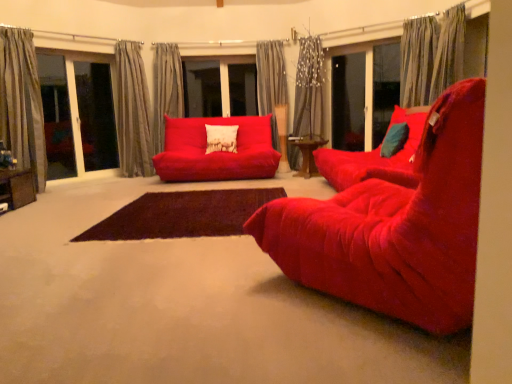
How much space does silky gray curtain at upper right, marked as the 1th curtain in a right-to-left arrangement, occupy horizontally?

silky gray curtain at upper right, marked as the 1th curtain in a right-to-left arrangement, is 13.60 inches in width.

How much space does textured beige curtain at upper left, placed as the 4th curtain when sorted from right to left, occupy horizontally?

textured beige curtain at upper left, placed as the 4th curtain when sorted from right to left, is 14.01 inches in width.

The image size is (512, 384). Find the location of `wooden table at center, the 1th table in the right-to-left sequence`. wooden table at center, the 1th table in the right-to-left sequence is located at coordinates (307, 154).

What do you see at coordinates (307, 154) in the screenshot? I see `wooden table at center, which is counted as the 2th table, starting from the left` at bounding box center [307, 154].

Locate an element on the screen. The height and width of the screenshot is (384, 512). gray textured curtain at center, acting as the 3th curtain starting from the right is located at coordinates (273, 94).

What do you see at coordinates (273, 94) in the screenshot? I see `gray textured curtain at center, which ranks as the fourth curtain in left-to-right order` at bounding box center [273, 94].

Where is `velvet red studio couch at center`? velvet red studio couch at center is located at coordinates (216, 151).

Is the depth of gray textured curtain at center, acting as the 3th curtain starting from the right, greater than that of transparent glass screen door at center, marked as the 2th screen door in a right-to-left arrangement?

Yes, it is behind transparent glass screen door at center, marked as the 2th screen door in a right-to-left arrangement.

From a real-world perspective, between gray textured curtain at center, acting as the 3th curtain starting from the right, and transparent glass screen door at center, arranged as the first screen door when viewed from the left, who is vertically higher?

gray textured curtain at center, acting as the 3th curtain starting from the right, is physically above.

Can transparent glass screen door at center, marked as the 2th screen door in a right-to-left arrangement, be found inside gray textured curtain at center, acting as the 3th curtain starting from the right?

Actually, transparent glass screen door at center, marked as the 2th screen door in a right-to-left arrangement, is outside gray textured curtain at center, acting as the 3th curtain starting from the right.

From the image's perspective, is silky gray curtain at upper right, which is the 6th curtain from left to right, above brown rug at center?

Yes, from the image's perspective, silky gray curtain at upper right, which is the 6th curtain from left to right, is above brown rug at center.

Is silky gray curtain at upper right, marked as the 1th curtain in a right-to-left arrangement, wider than brown rug at center?

In fact, silky gray curtain at upper right, marked as the 1th curtain in a right-to-left arrangement, might be narrower than brown rug at center.

Is the position of silky gray curtain at upper right, marked as the 1th curtain in a right-to-left arrangement, more distant than that of brown rug at center?

Yes, silky gray curtain at upper right, marked as the 1th curtain in a right-to-left arrangement, is further from the viewer.

Is velvet red studio couch at center positioned beyond the bounds of velvet red chair at center?

Indeed, velvet red studio couch at center is completely outside velvet red chair at center.

From the image's perspective, is velvet red studio couch at center on top of velvet red chair at center?

Yes.

Is velvet red studio couch at center to the left of velvet red chair at center from the viewer's perspective?

Yes.

From a real-world perspective, which is physically above, velvet red studio couch at center or velvet red chair at center?

In real-world perspective, velvet red studio couch at center is above.

Can you tell me how much gray textured curtain at center, marked as the second curtain in a right-to-left arrangement, and gray textured curtain at center, which ranks as the fourth curtain in left-to-right order, differ in facing direction?

A: 60.6 degrees.

Which object is thinner, gray textured curtain at center, marked as the second curtain in a right-to-left arrangement, or gray textured curtain at center, acting as the 3th curtain starting from the right?

With smaller width is gray textured curtain at center, acting as the 3th curtain starting from the right.

Considering the sizes of objects gray textured curtain at center, marked as the second curtain in a right-to-left arrangement, and gray textured curtain at center, which ranks as the fourth curtain in left-to-right order, in the image provided, who is taller, gray textured curtain at center, marked as the second curtain in a right-to-left arrangement, or gray textured curtain at center, which ranks as the fourth curtain in left-to-right order,?

gray textured curtain at center, marked as the second curtain in a right-to-left arrangement, is taller.

From the image's perspective, is gray textured curtain at center, marked as the second curtain in a right-to-left arrangement, on gray textured curtain at center, acting as the 3th curtain starting from the right?

No, from the image's perspective, gray textured curtain at center, marked as the second curtain in a right-to-left arrangement, is not over gray textured curtain at center, acting as the 3th curtain starting from the right.

Who is more distant, wooden table at center, the 1th table in the right-to-left sequence, or gray textured curtain at center, acting as the 3th curtain starting from the right?

gray textured curtain at center, acting as the 3th curtain starting from the right, is further from the camera.

In the scene shown: Which object is wider, wooden table at center, which is counted as the 2th table, starting from the left, or gray textured curtain at center, which ranks as the fourth curtain in left-to-right order?

wooden table at center, which is counted as the 2th table, starting from the left.

Is wooden table at center, which appears as the 2th table when viewed from the front, far away from gray textured curtain at center, which ranks as the fourth curtain in left-to-right order?

No, wooden table at center, which appears as the 2th table when viewed from the front, is not far away from gray textured curtain at center, which ranks as the fourth curtain in left-to-right order.

Considering the points (323, 140) and (267, 90), which point is behind, point (323, 140) or point (267, 90)?

The point (267, 90) is more distant.

Between teal velvet pillow at right, positioned as the 1th pillow in front-to-back order, and gray textured curtain at center, which ranks as the fourth curtain in left-to-right order, which one has smaller size?

Smaller between the two is teal velvet pillow at right, positioned as the 1th pillow in front-to-back order.

What's the angular difference between teal velvet pillow at right, positioned as the 1th pillow in front-to-back order, and gray textured curtain at center, which ranks as the fourth curtain in left-to-right order,'s facing directions?

There is a 95.4-degree angle between the facing directions of teal velvet pillow at right, positioned as the 1th pillow in front-to-back order, and gray textured curtain at center, which ranks as the fourth curtain in left-to-right order.

Between teal velvet pillow at right, which appears as the 2th pillow when viewed from the back, and gray textured curtain at center, acting as the 3th curtain starting from the right, which one has less height?

teal velvet pillow at right, which appears as the 2th pillow when viewed from the back, is shorter.

From a real-world perspective, between gray striped curtain at left, which is the 1th curtain in left-to-right order, and brown rug at center, who is vertically lower?

From a 3D spatial view, brown rug at center is below.

Can you confirm if gray striped curtain at left, which is the 1th curtain in left-to-right order, is smaller than brown rug at center?

No.

From the image's perspective, which one is positioned higher, gray striped curtain at left, which is the 1th curtain in left-to-right order, or brown rug at center?

From the image's view, gray striped curtain at left, which is the 1th curtain in left-to-right order, is above.

Is brown rug at center located within gray striped curtain at left, which is the 1th curtain in left-to-right order?

No, brown rug at center is not inside gray striped curtain at left, which is the 1th curtain in left-to-right order.

The width and height of the screenshot is (512, 384). In order to click on the 1st screen door counting from the right side of the gray textured curtain at center, which ranks as the fourth curtain in left-to-right order in this screenshot , I will do `click(348, 101)`.

The height and width of the screenshot is (384, 512). In order to click on plain below the silky gray curtain at upper right, which is the 6th curtain from left to right (from the image's perspective) in this screenshot , I will do `click(182, 215)`.

Considering their positions, is matte glass screen door at center right, which is the first screen door from right to left, positioned further to wooden table at center, which appears as the 2th table when viewed from the front, than teal velvet pillow at right, which is the 2th pillow in left-to-right order?

teal velvet pillow at right, which is the 2th pillow in left-to-right order, is further to wooden table at center, which appears as the 2th table when viewed from the front.

Considering their positions, is matte glass screen door at center right, the 2th screen door when ordered from left to right, positioned further to transparent glass window at left than velvet red chair at center?

velvet red chair at center.

Considering their positions, is transparent glass screen door at center, marked as the 2th screen door in a right-to-left arrangement, positioned further to silky gray curtain at upper right, which is the 6th curtain from left to right, than gray textured curtain at center, acting as the 3th curtain starting from the right?

gray textured curtain at center, acting as the 3th curtain starting from the right, is further to silky gray curtain at upper right, which is the 6th curtain from left to right.

From the image, which object appears to be nearer to silky gray curtain at upper right, marked as the 1th curtain in a right-to-left arrangement, matte glass screen door at center right, which is the first screen door from right to left, or gray striped curtain at left, the sixth curtain from the right?

matte glass screen door at center right, which is the first screen door from right to left, lies closer to silky gray curtain at upper right, marked as the 1th curtain in a right-to-left arrangement, than the other object.

Considering their positions, is matte glass screen door at center right, the 2th screen door when ordered from left to right, positioned closer to textured beige curtain at upper left, the 3th curtain when ordered from left to right, than brown rug at center?

matte glass screen door at center right, the 2th screen door when ordered from left to right, is closer to textured beige curtain at upper left, the 3th curtain when ordered from left to right.

Based on their spatial positions, is matte glass screen door at center right, which is the first screen door from right to left, or velvet red studio couch at center closer to velvet cushion at center, marked as the first pillow in a left-to-right arrangement?

velvet red studio couch at center lies closer to velvet cushion at center, marked as the first pillow in a left-to-right arrangement, than the other object.

Looking at the image, which one is located closer to wooden table at center, acting as the 1th table starting from the top, velvet cushion at center, marked as the first pillow in a left-to-right arrangement, or transparent glass window at left?

velvet cushion at center, marked as the first pillow in a left-to-right arrangement, is closer to wooden table at center, acting as the 1th table starting from the top.

Considering their positions, is gray textured curtain at center, which ranks as the fourth curtain in left-to-right order, positioned further to teal velvet pillow at right, which is the 2th pillow in left-to-right order, than brown rug at center?

gray textured curtain at center, which ranks as the fourth curtain in left-to-right order, is further to teal velvet pillow at right, which is the 2th pillow in left-to-right order.

At what (x,y) coordinates should I click in order to perform the action: click on table between teal velvet pillow at right, which is counted as the 1th pillow, starting from the right, and transparent glass screen door at center, marked as the 2th screen door in a right-to-left arrangement, along the z-axis. Please return your answer as a coordinate pair (x, y). The width and height of the screenshot is (512, 384). Looking at the image, I should click on (307, 154).

In order to click on window positioned between velvet red chair at center and gray textured curtain at left, placed as the 2th curtain when sorted from left to right, from near to far in this screenshot , I will do `click(77, 113)`.

The image size is (512, 384). What are the coordinates of `plain between velvet red chair at center and silky gray curtain at upper right, marked as the 1th curtain in a right-to-left arrangement, in the front-back direction` in the screenshot? It's located at (182, 215).

Locate an element on the screen. The width and height of the screenshot is (512, 384). studio couch between textured beige curtain at upper left, the 3th curtain when ordered from left to right, and wooden table at center, which appears as the 2th table when viewed from the front, from left to right is located at coordinates (216, 151).